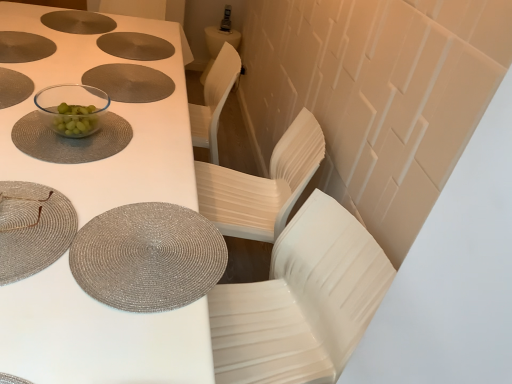
In order to click on vacant space to the right of transparent glass bowl at center, which appears as the 3th tableware when viewed from the front in this screenshot , I will do (152, 156).